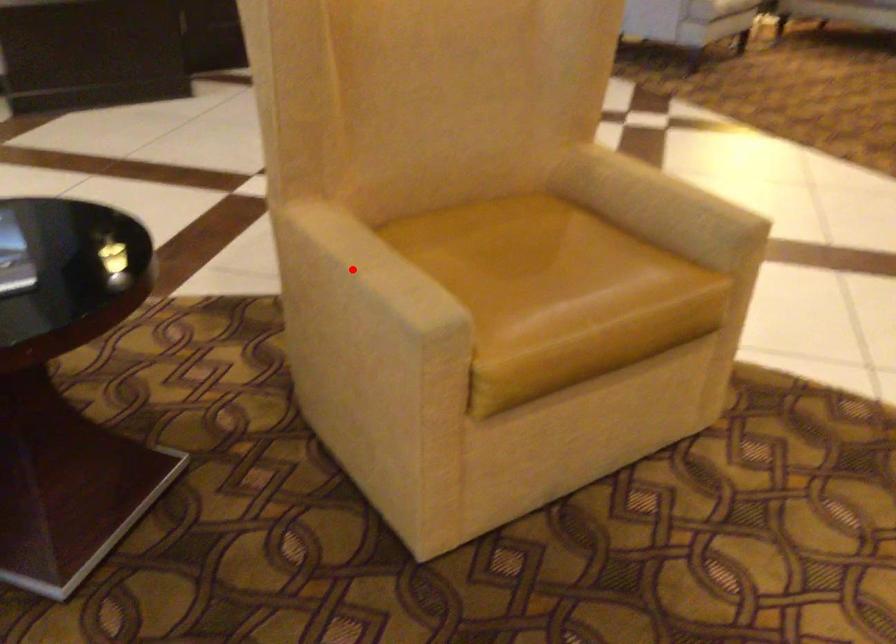
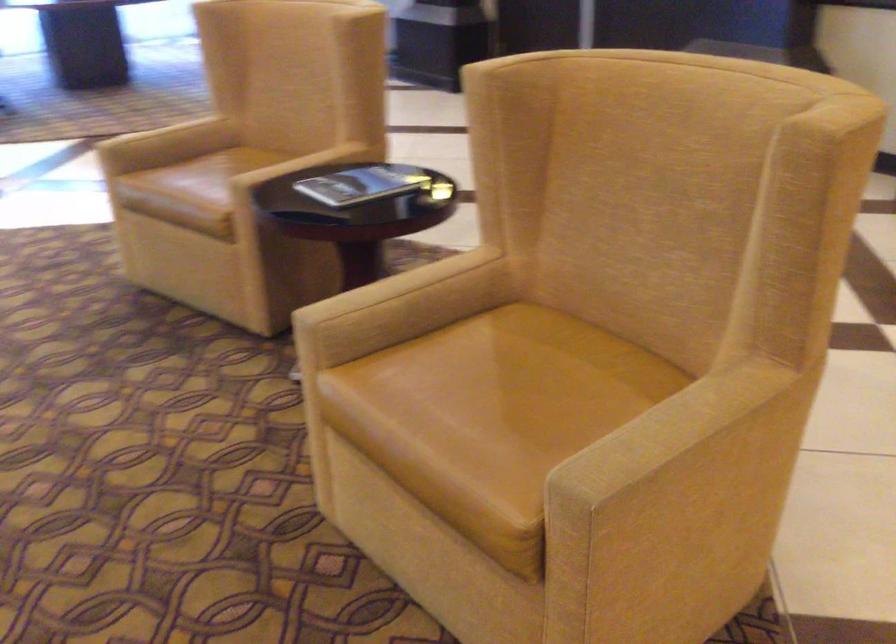
Question: I am providing you with two images of the same scene from different viewpoints. Given a red point in image1, look at the same physical point in image2. Is it:

Choices:
 (A) Closer to the viewpoint
 (B) Farther from the viewpoint

Answer: (B)